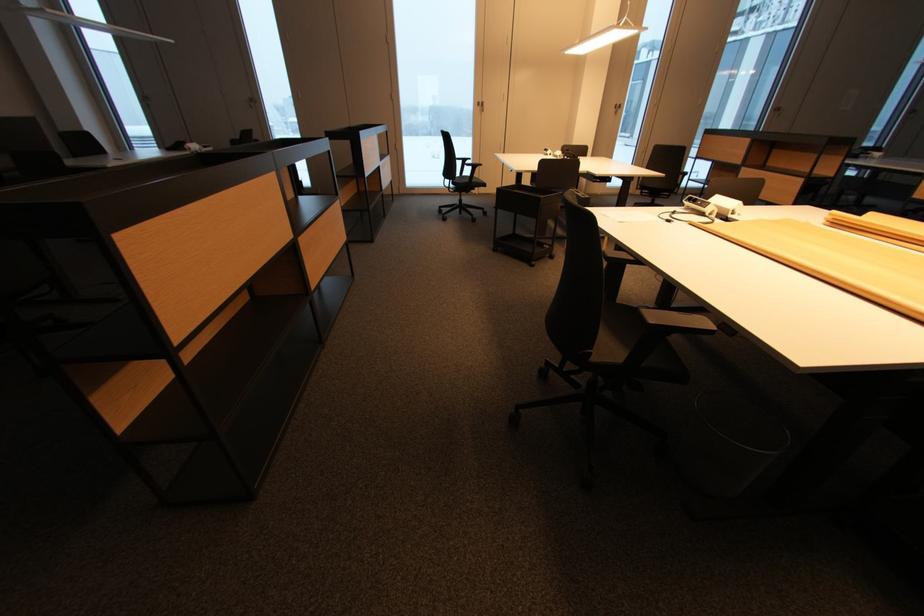
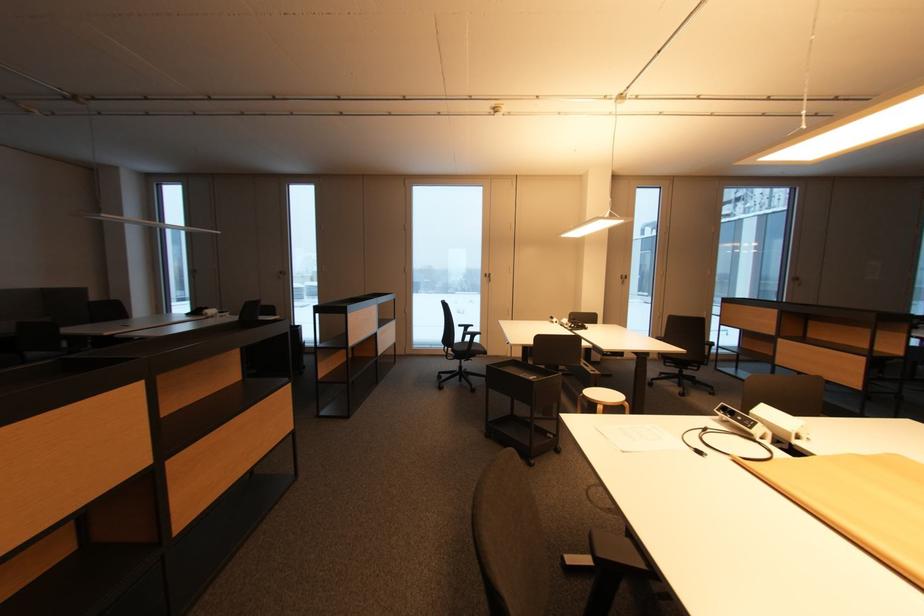
Question: How did the camera likely rotate?

Choices:
 (A) Left
 (B) Right
 (C) Up
 (D) Down

Answer: (C)